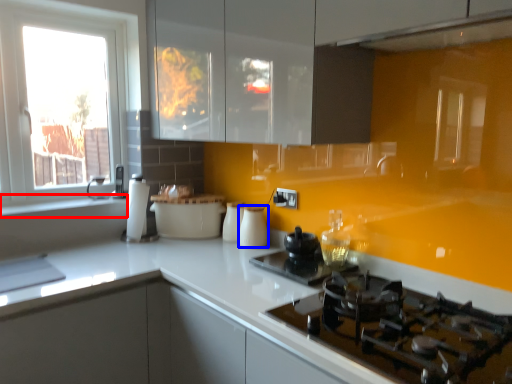
Question: Among these objects, which one is farthest to the camera, window sill (highlighted by a red box) or kitchen appliance (highlighted by a blue box)?

Choices:
 (A) window sill
 (B) kitchen appliance

Answer: (B)